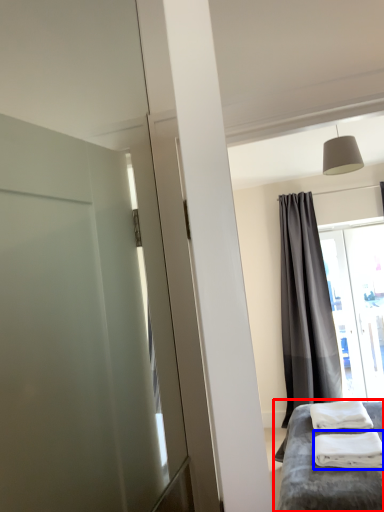
Question: Which point is further to the camera, furniture (highlighted by a red box) or material (highlighted by a blue box)?

Choices:
 (A) furniture
 (B) material

Answer: (B)